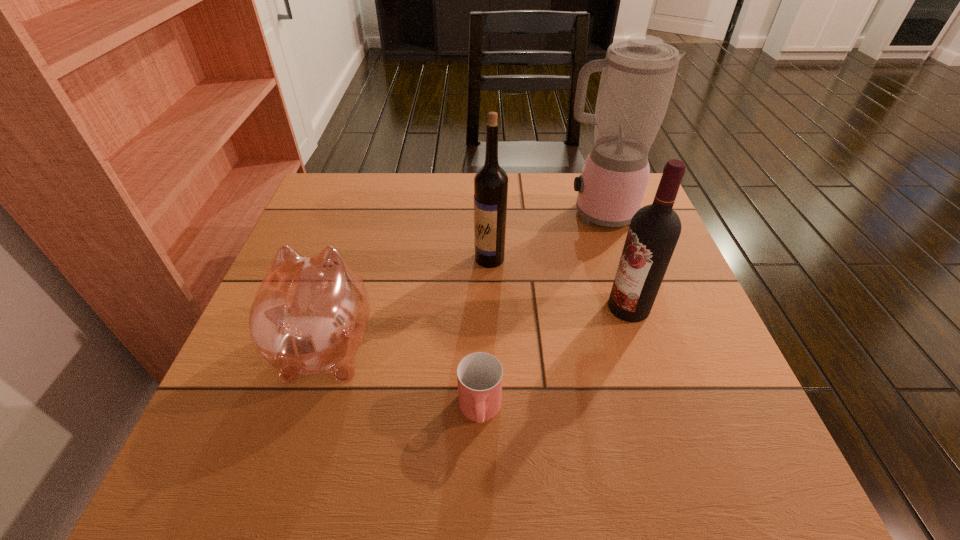
The image size is (960, 540). In the image, there is a desktop. Identify the location of vacant space at the far left corner. (369, 193).

At what (x,y) coordinates should I click in order to perform the action: click on free space at the near right corner of the desktop. Please return your answer as a coordinate pair (x, y). Image resolution: width=960 pixels, height=540 pixels. Looking at the image, I should click on (696, 448).

The height and width of the screenshot is (540, 960). Identify the location of vacant region between the nearer wine bottle and the farthest object. (613, 260).

The image size is (960, 540). I want to click on vacant area that lies between the left wine bottle and the second shortest object, so click(x=408, y=302).

Where is `free point between the food processor and the shortest object`? Image resolution: width=960 pixels, height=540 pixels. free point between the food processor and the shortest object is located at coordinates (539, 312).

You are a GUI agent. You are given a task and a screenshot of the screen. Output one action in this format:
    pyautogui.click(x=<x>, y=<y>)
    Task: Click on the vacant space that is in between the nearer wine bottle and the cup
    The image size is (960, 540).
    Given the screenshot: What is the action you would take?
    coord(554,360)

The height and width of the screenshot is (540, 960). Identify the location of vacant region between the farther wine bottle and the leftmost object. (408, 302).

Identify the location of vacant area that lies between the second shortest object and the cup. (403, 379).

You are a GUI agent. You are given a task and a screenshot of the screen. Output one action in this format:
    pyautogui.click(x=<x>, y=<y>)
    Task: Click on the empty location between the right wine bottle and the tallest object
    The image size is (960, 540).
    Given the screenshot: What is the action you would take?
    pyautogui.click(x=613, y=260)

At what (x,y) coordinates should I click in order to perform the action: click on free space between the second farthest object and the nearer wine bottle. Please return your answer as a coordinate pair (x, y). The height and width of the screenshot is (540, 960). Looking at the image, I should click on (559, 283).